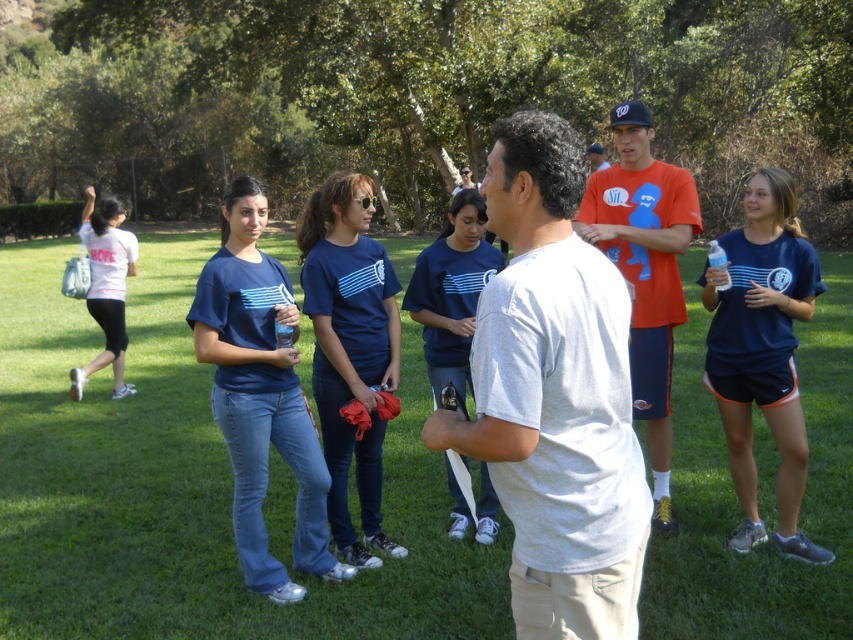
You are standing at the point with coordinates point (601,147) and want to walk towards the point (119,305). Which direction should you face to move directly towards your destination?

You should face forward because point (119,305) is in front of point (601,147).

You are at the point marked by the coordinates (350, 349) in the image. Which object is exactly at this location?

The navy blue t shirt at center is exactly at the coordinates (350, 349).